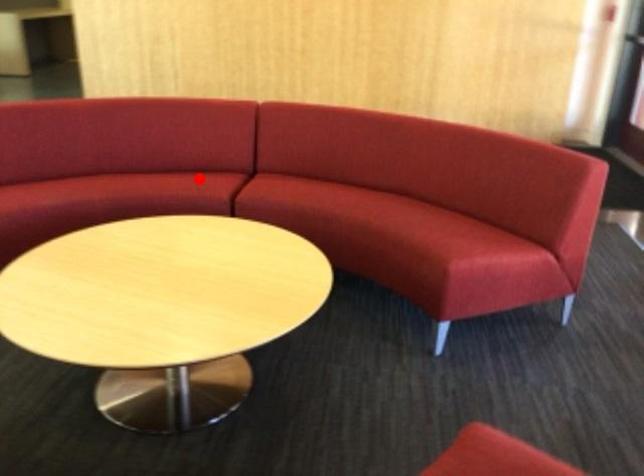
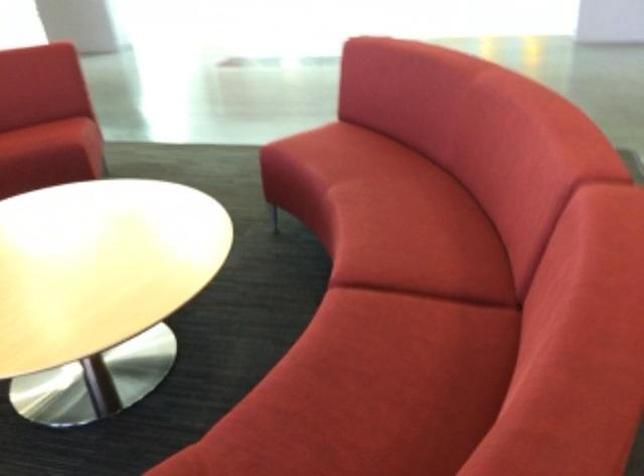
Question: I am providing you with two images of the same scene from different viewpoints. A red point is marked on the first image. Can you still see the location of the red point in image 2?

Choices:
 (A) Yes
 (B) No

Answer: (A)